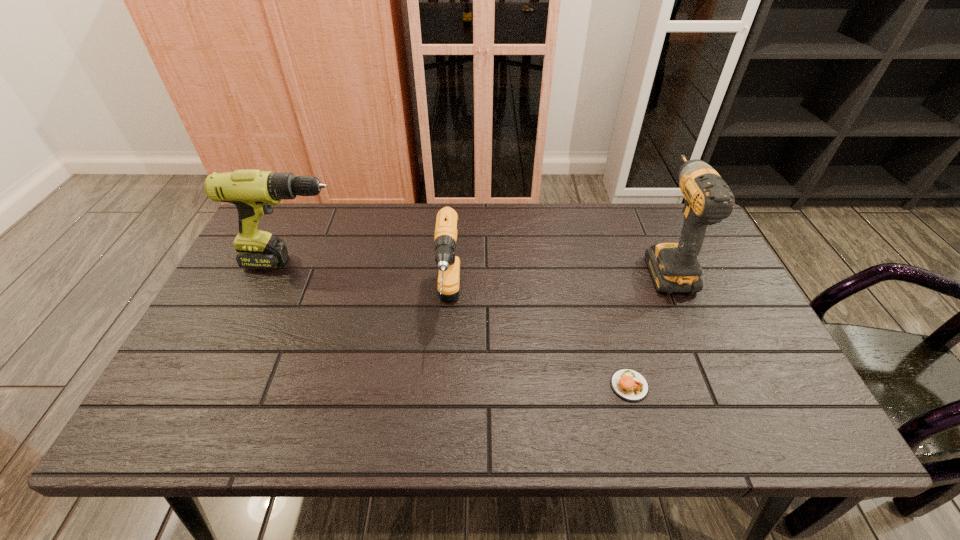
You are a GUI agent. You are given a task and a screenshot of the screen. Output one action in this format:
    pyautogui.click(x=<x>, y=<y>)
    Task: Click on the free space that satisfies the following two spatial constraints: 1. on the handle side of the leftmost drill; 2. with the drill bit of the rightmost drill facing forward
    The image size is (960, 540).
    Given the screenshot: What is the action you would take?
    pyautogui.click(x=295, y=265)

Find the location of a particular element. vacant position in the image that satisfies the following two spatial constraints: 1. with the drill bit of the rightmost drill facing forward; 2. on the handle side of the leftmost object is located at coordinates (664, 262).

Where is `vacant area that satisfies the following two spatial constraints: 1. at the tip of the third tallest object; 2. on the left side of the shortest object`? vacant area that satisfies the following two spatial constraints: 1. at the tip of the third tallest object; 2. on the left side of the shortest object is located at coordinates tap(444, 386).